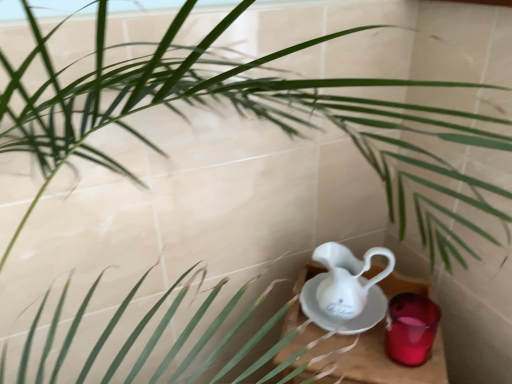
This screenshot has width=512, height=384. Identify the location of free spot above wooden table at lower right (from a real-world perspective). (359, 343).